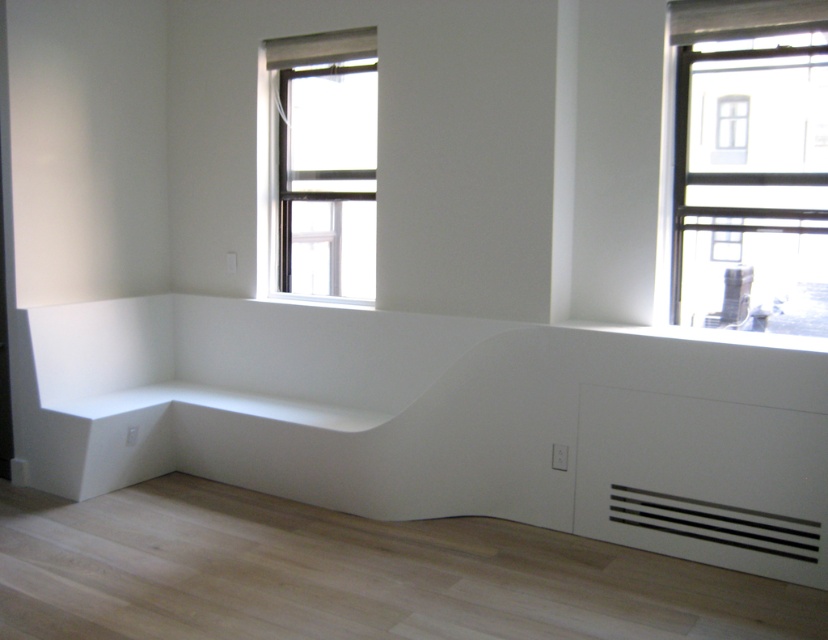
Question: Does white smooth bench at lower left appear on the left side of transparent glass chair at upper right?

Choices:
 (A) yes
 (B) no

Answer: (A)

Question: Is white smooth bench at lower left below clear glass window at upper center?

Choices:
 (A) yes
 (B) no

Answer: (A)

Question: Estimate the real-world distances between objects in this image. Which object is farther from the clear glass window at upper center?

Choices:
 (A) white smooth bench at lower left
 (B) transparent glass chair at upper right

Answer: (B)

Question: Is white smooth bench at lower left below transparent glass chair at upper right?

Choices:
 (A) no
 (B) yes

Answer: (B)

Question: Among these points, which one is farthest from the camera?

Choices:
 (A) [350, 97]
 (B) [593, 422]
 (C) [759, 186]

Answer: (A)

Question: Which point is farther to the camera?

Choices:
 (A) transparent glass chair at upper right
 (B) clear glass window at upper center
 (C) white smooth bench at lower left

Answer: (B)